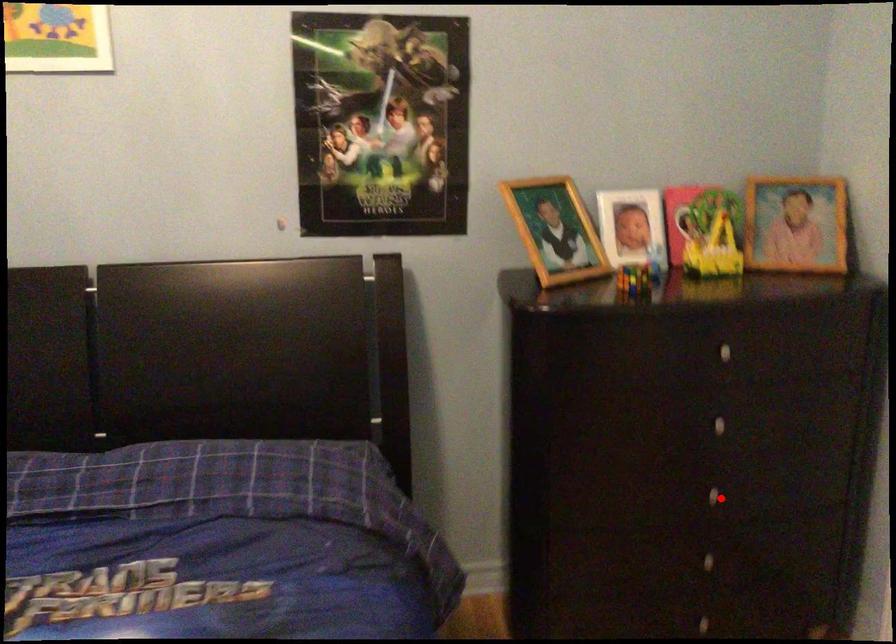
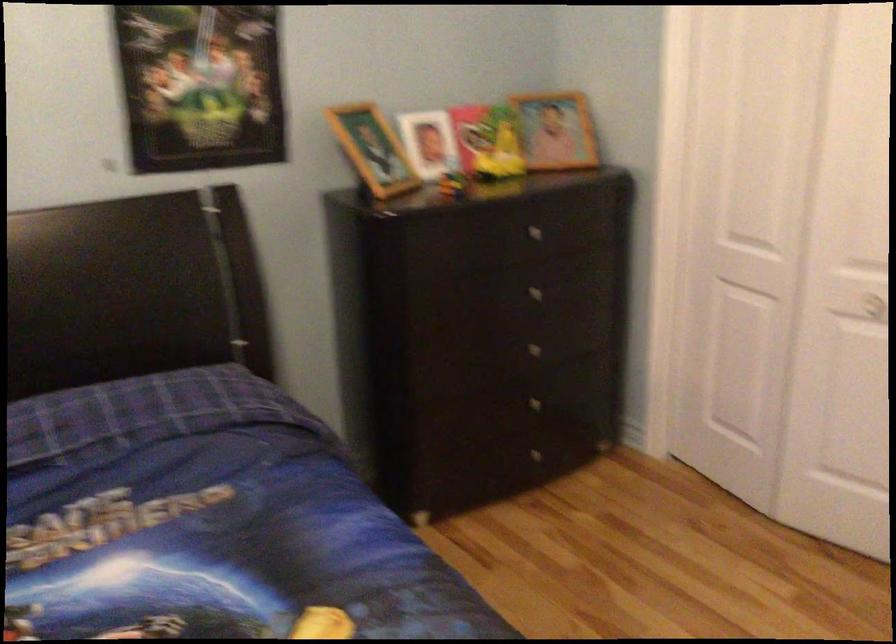
Question: I am providing you with two images of the same scene from different viewpoints. A red point is shown in image1. For the corresponding object point in image2, is it positioned nearer or farther from the camera?

Choices:
 (A) Nearer
 (B) Farther

Answer: (B)